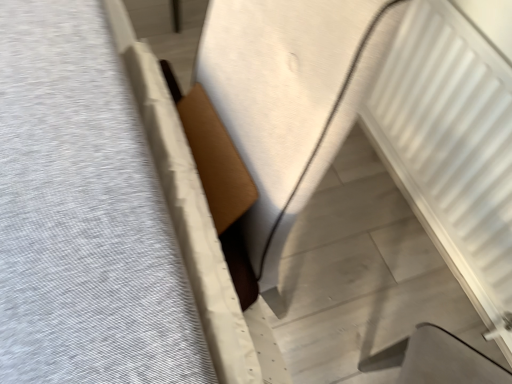
In order to click on white matte radiator at right in this screenshot , I will do `click(451, 144)`.

What do you see at coordinates (451, 144) in the screenshot?
I see `white matte radiator at right` at bounding box center [451, 144].

Locate an element on the screen. white matte radiator at right is located at coordinates pos(451,144).